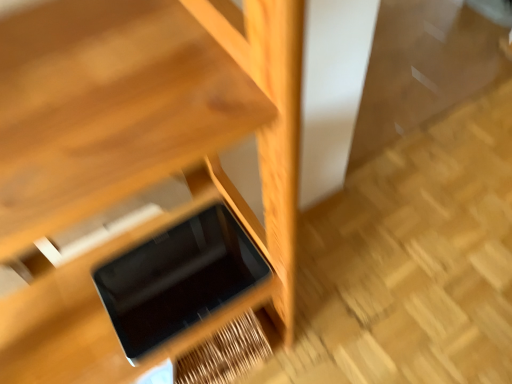
The height and width of the screenshot is (384, 512). Describe the element at coordinates (178, 279) in the screenshot. I see `black plastic ipad at center` at that location.

Measure the distance between point [125,281] and camera.

Point [125,281] is 26.02 inches away from camera.

The height and width of the screenshot is (384, 512). Find the location of `black plastic ipad at center`. black plastic ipad at center is located at coordinates (178, 279).

You are a GUI agent. You are given a task and a screenshot of the screen. Output one action in this format:
    pyautogui.click(x=<x>, y=<y>)
    Task: Click on the black plastic ipad at center
    The width and height of the screenshot is (512, 384).
    Given the screenshot: What is the action you would take?
    pyautogui.click(x=178, y=279)